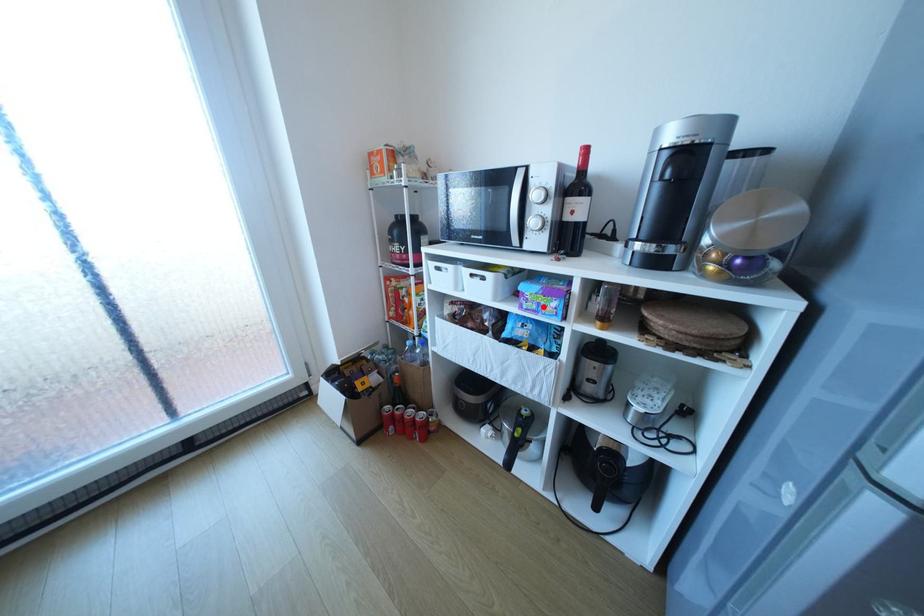
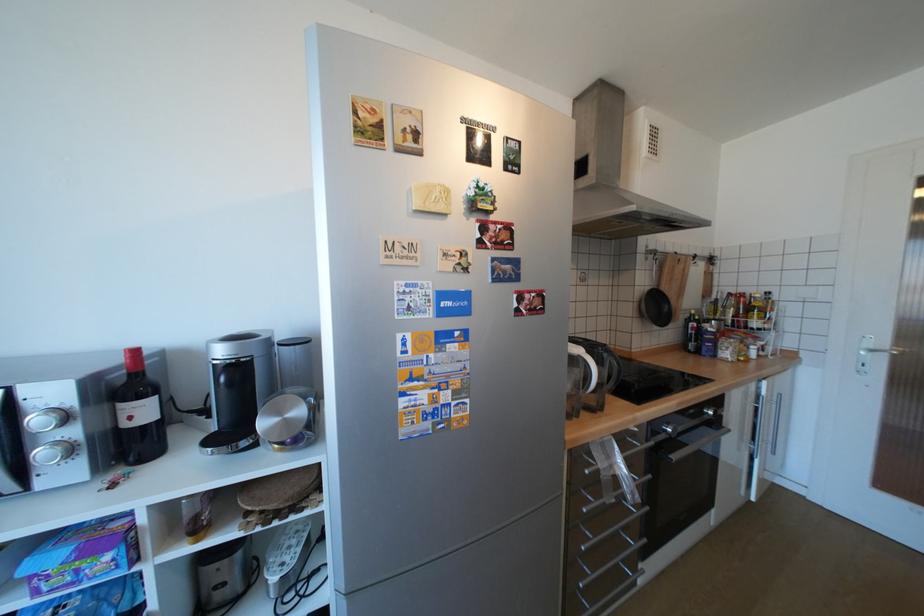
Question: I am providing you with two images of the same scene from different viewpoints. In image1, a red point is highlighted. Considering the same 3D point in image2, which of the following is correct?

Choices:
 (A) It is closer
 (B) It is farther

Answer: (A)